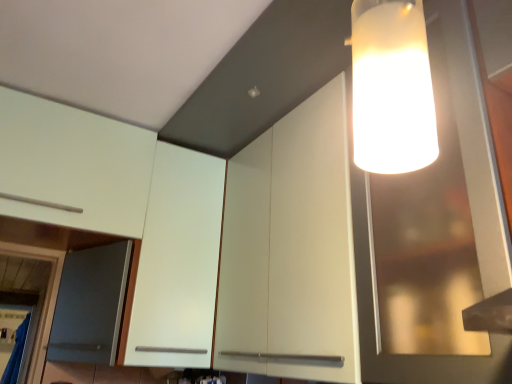
Question: Is white matte cabinet at upper left, which is counted as the third cabinetry, starting from the right, facing away from white matte cabinet at upper right, arranged as the 1th cabinetry when viewed from the right?

Choices:
 (A) yes
 (B) no

Answer: (B)

Question: Does white matte cabinet at upper left, which is counted as the third cabinetry, starting from the right, have a smaller size compared to white matte cabinet at upper right, placed as the third cabinetry when sorted from left to right?

Choices:
 (A) yes
 (B) no

Answer: (A)

Question: Could white matte cabinet at upper right, arranged as the 1th cabinetry when viewed from the right, be considered to be inside white matte cabinet at upper left, which is counted as the third cabinetry, starting from the right?

Choices:
 (A) no
 (B) yes

Answer: (A)

Question: Is white matte cabinet at upper left, which is counted as the third cabinetry, starting from the right, not close to white matte cabinet at upper right, arranged as the 1th cabinetry when viewed from the right?

Choices:
 (A) yes
 (B) no

Answer: (B)

Question: Considering the relative positions of white matte cabinet at upper left, which is counted as the third cabinetry, starting from the right, and white matte cabinet at upper right, arranged as the 1th cabinetry when viewed from the right, in the image provided, is white matte cabinet at upper left, which is counted as the third cabinetry, starting from the right, behind white matte cabinet at upper right, arranged as the 1th cabinetry when viewed from the right,?

Choices:
 (A) no
 (B) yes

Answer: (B)

Question: Looking at the image, does white matte cabinet at upper left, marked as the second cabinetry in a right-to-left arrangement, seem bigger or smaller compared to transparent glass cabinet at upper right?

Choices:
 (A) small
 (B) big

Answer: (A)

Question: From their relative heights in the image, would you say white matte cabinet at upper left, marked as the second cabinetry in a right-to-left arrangement, is taller or shorter than transparent glass cabinet at upper right?

Choices:
 (A) short
 (B) tall

Answer: (B)

Question: Is point (219, 172) positioned closer to the camera than point (410, 178)?

Choices:
 (A) farther
 (B) closer

Answer: (A)

Question: Is white matte cabinet at upper left, marked as the second cabinetry in a right-to-left arrangement, inside the boundaries of transparent glass cabinet at upper right, or outside?

Choices:
 (A) outside
 (B) inside

Answer: (A)

Question: Based on their sizes in the image, would you say white matte cabinet at upper right, placed as the third cabinetry when sorted from left to right, is bigger or smaller than transparent glass cabinet at upper right?

Choices:
 (A) small
 (B) big

Answer: (A)

Question: Is white matte cabinet at upper right, placed as the third cabinetry when sorted from left to right, wider or thinner than transparent glass cabinet at upper right?

Choices:
 (A) wide
 (B) thin

Answer: (B)

Question: From a real-world perspective, is white matte cabinet at upper right, arranged as the 1th cabinetry when viewed from the right, positioned above or below transparent glass cabinet at upper right?

Choices:
 (A) below
 (B) above

Answer: (A)

Question: Is white matte cabinet at upper right, arranged as the 1th cabinetry when viewed from the right, taller or shorter than transparent glass cabinet at upper right?

Choices:
 (A) tall
 (B) short

Answer: (B)

Question: From the image's perspective, is white matte cabinet at upper left, arranged as the 2th cabinetry when viewed from the left, above or below white matte cabinet at upper right, arranged as the 1th cabinetry when viewed from the right?

Choices:
 (A) above
 (B) below

Answer: (B)

Question: In the image, is white matte cabinet at upper left, arranged as the 2th cabinetry when viewed from the left, positioned in front of or behind white matte cabinet at upper right, placed as the third cabinetry when sorted from left to right?

Choices:
 (A) front
 (B) behind

Answer: (B)